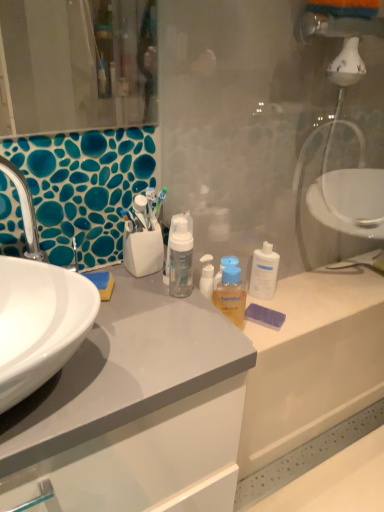
Where is `vacant point to the right of transparent plastic bottle at center`? The height and width of the screenshot is (512, 384). vacant point to the right of transparent plastic bottle at center is located at coordinates (313, 296).